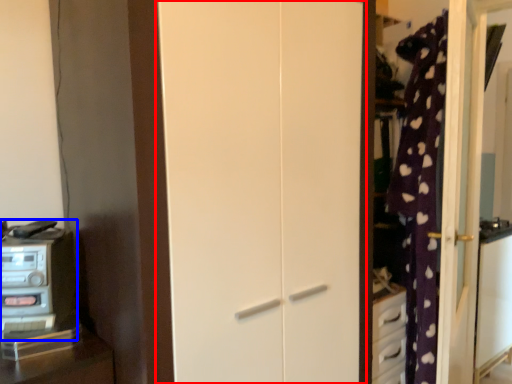
Question: Among these objects, which one is nearest to the camera, door (highlighted by a red box) or appliance (highlighted by a blue box)?

Choices:
 (A) door
 (B) appliance

Answer: (A)